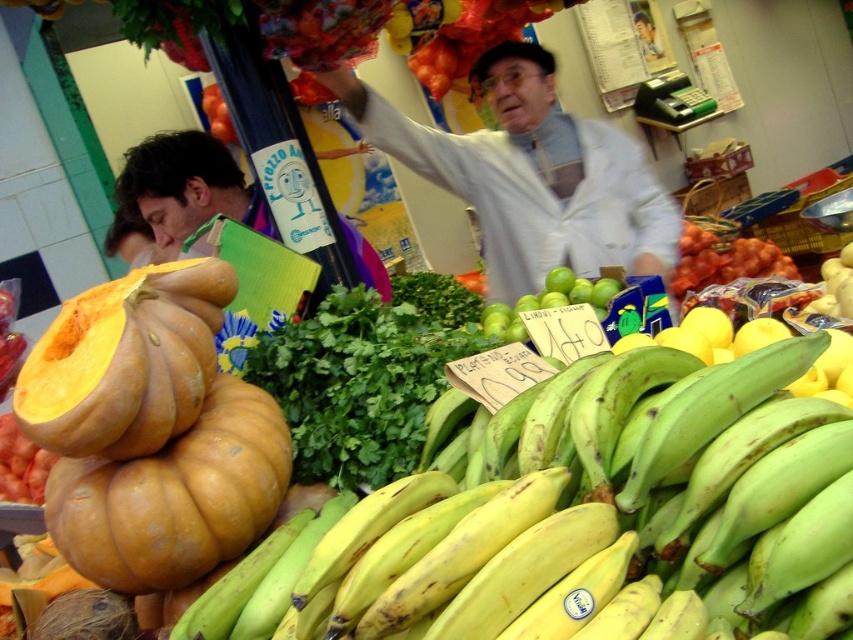
Does point (483, 150) lie in front of point (364, 250)?

No, it is behind (364, 250).

Find the location of a particular element. This screenshot has width=853, height=640. light gray jacket at center is located at coordinates (531, 176).

Does orange matte pumpkin at left appear on the left side of smooth orange tomato at upper center?

No, orange matte pumpkin at left is not to the left of smooth orange tomato at upper center.

Does orange matte pumpkin at left have a larger size compared to smooth orange tomato at upper center?

Correct, orange matte pumpkin at left is larger in size than smooth orange tomato at upper center.

Is point (264, 464) closer to camera compared to point (212, 124)?

Yes, it is in front of point (212, 124).

Where is `orange matte pumpkin at left`? This screenshot has height=640, width=853. orange matte pumpkin at left is located at coordinates (173, 497).

Based on the photo, does green leafymaterial/texturevegetable at center come behind orange fleshed squash at left?

Yes, it is behind orange fleshed squash at left.

Is point (378, 396) positioned before point (20, 396)?

No, (378, 396) is behind (20, 396).

This screenshot has height=640, width=853. Identify the location of green leafymaterial/texturevegetable at center. (364, 376).